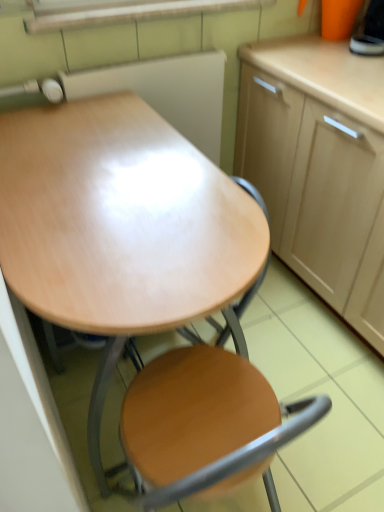
Question: From the image's perspective, is wooden at center under light wood cabinet at upper right?

Choices:
 (A) yes
 (B) no

Answer: (A)

Question: Can you confirm if wooden at center is positioned to the right of light wood cabinet at upper right?

Choices:
 (A) no
 (B) yes

Answer: (A)

Question: Is light wood cabinet at upper right at the back of wooden at center?

Choices:
 (A) yes
 (B) no

Answer: (B)

Question: From a real-world perspective, is wooden at center on light wood cabinet at upper right?

Choices:
 (A) yes
 (B) no

Answer: (B)

Question: Is wooden at center not inside light wood cabinet at upper right?

Choices:
 (A) no
 (B) yes

Answer: (B)

Question: Considering the relative sizes of wooden at center and light wood cabinet at upper right in the image provided, is wooden at center thinner than light wood cabinet at upper right?

Choices:
 (A) no
 (B) yes

Answer: (B)

Question: Can you confirm if wooden desk at center is bigger than wooden at center?

Choices:
 (A) no
 (B) yes

Answer: (B)

Question: Is wooden desk at center positioned behind wooden at center?

Choices:
 (A) no
 (B) yes

Answer: (B)

Question: From a real-world perspective, is wooden desk at center positioned over wooden at center based on gravity?

Choices:
 (A) no
 (B) yes

Answer: (B)

Question: Can you see wooden desk at center touching wooden at center?

Choices:
 (A) yes
 (B) no

Answer: (B)

Question: Is wooden desk at center completely or partially outside of wooden at center?

Choices:
 (A) yes
 (B) no

Answer: (A)

Question: Is wooden desk at center to the right of wooden at center from the viewer's perspective?

Choices:
 (A) no
 (B) yes

Answer: (A)

Question: Is wooden at center positioned far away from wooden desk at center?

Choices:
 (A) yes
 (B) no

Answer: (B)